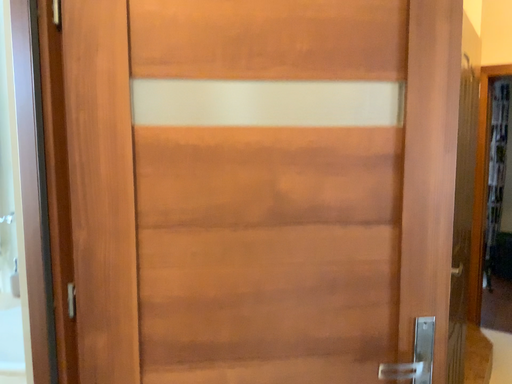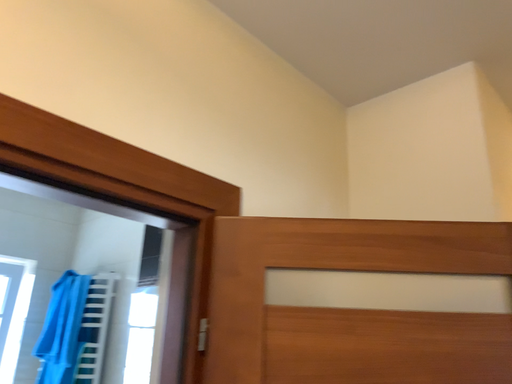
Question: How did the camera likely rotate when shooting the video?

Choices:
 (A) rotated downward
 (B) rotated upward

Answer: (B)